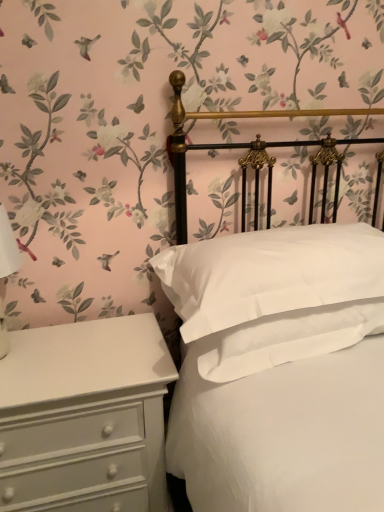
Where is `empty space that is ontop of white painted wood chest of drawers at lower left (from a real-world perspective)`? The image size is (384, 512). empty space that is ontop of white painted wood chest of drawers at lower left (from a real-world perspective) is located at coordinates (77, 353).